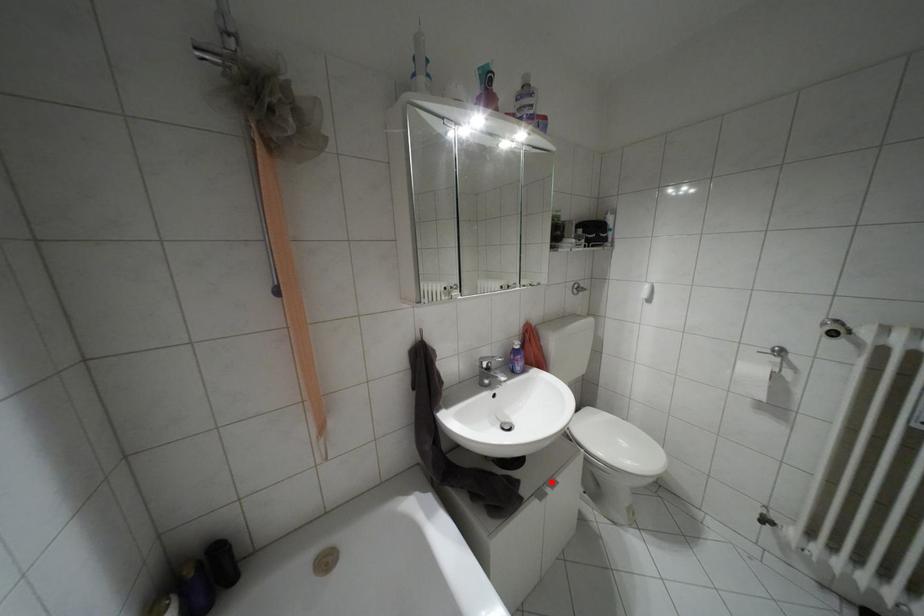
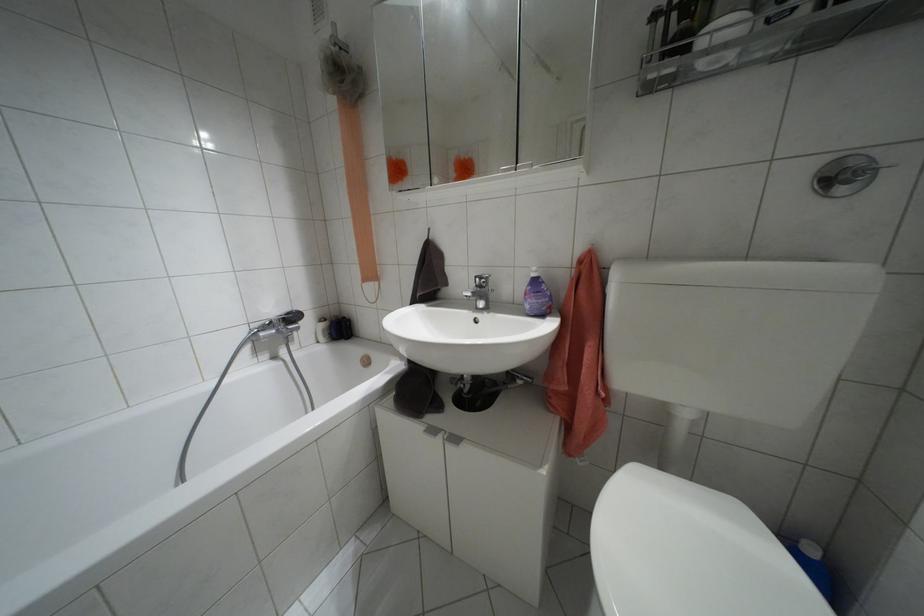
Question: I am providing you with two images of the same scene from different viewpoints. In image1, a red point is highlighted. Considering the same 3D point in image2, which of the following is correct?

Choices:
 (A) It is closer
 (B) It is farther

Answer: (A)